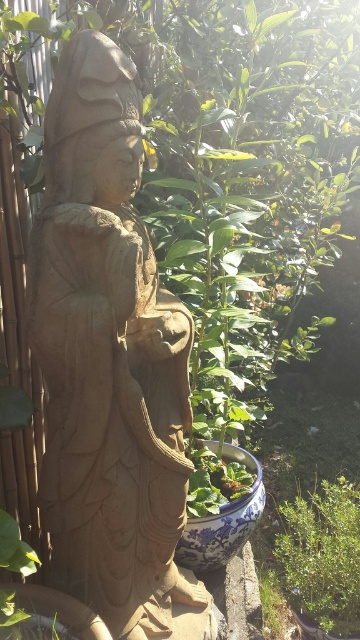
Question: Which object appears farthest from the camera in this image?

Choices:
 (A) smooth beige statue at center
 (B) green leafy plant at lower right

Answer: (B)

Question: Which object appears closest to the camera in this image?

Choices:
 (A) green leafy plant at lower right
 (B) smooth beige statue at center

Answer: (B)

Question: Is smooth beige statue at center to the right of green leafy plant at lower right from the viewer's perspective?

Choices:
 (A) yes
 (B) no

Answer: (B)

Question: Does smooth beige statue at center have a lesser width compared to green leafy plant at lower right?

Choices:
 (A) yes
 (B) no

Answer: (B)

Question: Is smooth beige statue at center wider than green leafy plant at lower right?

Choices:
 (A) no
 (B) yes

Answer: (B)